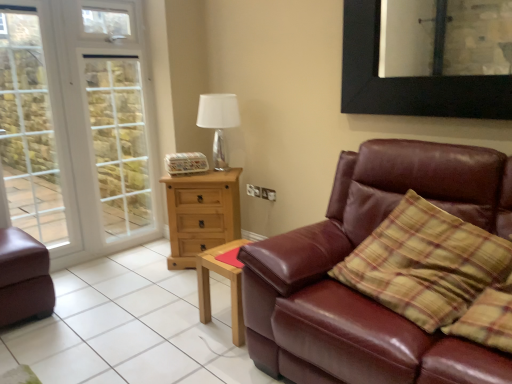
The height and width of the screenshot is (384, 512). What do you see at coordinates (230, 286) in the screenshot?
I see `light wood rectangular table at center` at bounding box center [230, 286].

The width and height of the screenshot is (512, 384). What do you see at coordinates (356, 291) in the screenshot? I see `shiny brown leather couch at right, which is counted as the 1th studio couch, starting from the right` at bounding box center [356, 291].

The height and width of the screenshot is (384, 512). Identify the location of white glass window at left. pyautogui.click(x=34, y=129).

Considering the sizes of objects white glossy table lamp at upper center and white glass screen door at left in the image provided, who is taller, white glossy table lamp at upper center or white glass screen door at left?

Standing taller between the two is white glass screen door at left.

In the image, there is a white glass screen door at left. Identify the location of table lamp below it (from a real-world perspective). (218, 122).

Is white glossy table lamp at upper center inside the boundaries of white glass screen door at left, or outside?

white glossy table lamp at upper center cannot be found inside white glass screen door at left.

How far apart are white glossy table lamp at upper center and white glass screen door at left?

white glossy table lamp at upper center and white glass screen door at left are 1.18 meters apart.

Are light wood rectangular table at center and white glass screen door at left making contact?

No, light wood rectangular table at center is not with white glass screen door at left.

Is light wood rectangular table at center in front of or behind white glass screen door at left in the image?

light wood rectangular table at center is positioned closer to the viewer than white glass screen door at left.

Is light wood rectangular table at center inside the boundaries of white glass screen door at left, or outside?

light wood rectangular table at center is spatially situated outside white glass screen door at left.

Between light wood rectangular table at center and white glass screen door at left, which one appears on the right side from the viewer's perspective?

light wood rectangular table at center.

Consider the image. Is white glass window at left surrounding shiny brown leather couch at right, which is counted as the 1th studio couch, starting from the right?

No, shiny brown leather couch at right, which is counted as the 1th studio couch, starting from the right, is not surrounded by white glass window at left.

Is white glass window at left taller than shiny brown leather couch at right, the 2th studio couch viewed from the left?

Correct, white glass window at left is much taller as shiny brown leather couch at right, the 2th studio couch viewed from the left.

Is white glass window at left facing away from shiny brown leather couch at right, the 2th studio couch viewed from the left?

white glass window at left does not have its back to shiny brown leather couch at right, the 2th studio couch viewed from the left.

In the scene shown: From the image's perspective, which one is positioned higher, white glass window at left or shiny brown leather couch at right, the 2th studio couch viewed from the left?

white glass window at left.

Would you consider white glass screen door at left to be distant from white glass window at left?

No, white glass screen door at left is not far from white glass window at left.

In the scene shown: Considering the sizes of objects white glass screen door at left and white glass window at left in the image provided, who is taller, white glass screen door at left or white glass window at left?

Standing taller between the two is white glass screen door at left.

Is white glass screen door at left behind white glass window at left?

That is True.

Which of these two, white glass screen door at left or white glass window at left, is thinner?

Result: white glass window at left is thinner.

Which object is closer to the camera, white glossy table lamp at upper center or light brown wooden chest of drawers at center?

light brown wooden chest of drawers at center is in front.

Can you confirm if white glossy table lamp at upper center is wider than light brown wooden chest of drawers at center?

In fact, white glossy table lamp at upper center might be narrower than light brown wooden chest of drawers at center.

Based on the photo, is white glossy table lamp at upper center in contact with light brown wooden chest of drawers at center?

white glossy table lamp at upper center and light brown wooden chest of drawers at center are not in contact.

Considering the positions of point (223, 115) and point (196, 252), is point (223, 115) closer or farther from the camera than point (196, 252)?

Clearly, point (223, 115) is closer to the camera than point (196, 252).

From a real-world perspective, which object rests below the other?

light wood rectangular table at center is physically lower.

Relative to light wood rectangular table at center, is white glossy table lamp at upper center in front or behind?

Visually, white glossy table lamp at upper center is located behind light wood rectangular table at center.

Considering the positions of objects white glossy table lamp at upper center and light wood rectangular table at center in the image provided, who is more to the right, white glossy table lamp at upper center or light wood rectangular table at center?

Positioned to the right is light wood rectangular table at center.

Considering the sizes of white glossy table lamp at upper center and light wood rectangular table at center in the image, is white glossy table lamp at upper center wider or thinner than light wood rectangular table at center?

Clearly, white glossy table lamp at upper center has less width compared to light wood rectangular table at center.

Based on their positions, is white glass window at left located to the left or right of white glass screen door at left?

white glass window at left is positioned on white glass screen door at left's left side.

Looking at this image, is white glass window at left positioned with its back to white glass screen door at left?

No, white glass window at left's orientation is not away from white glass screen door at left.

Is point (0, 138) positioned in front of point (88, 115)?

Yes, it is.

Can you confirm if white glass window at left is shorter than white glass screen door at left?

Yes, white glass window at left is shorter than white glass screen door at left.

Where is `screen door that appears in front of the white glossy table lamp at upper center`? screen door that appears in front of the white glossy table lamp at upper center is located at coordinates (120, 143).

The width and height of the screenshot is (512, 384). I want to click on table that is on the right side of white glass screen door at left, so click(x=230, y=286).

From the image, which object appears to be farther from brown leather couch at lower right, light wood rectangular table at center or light brown wooden chest of drawers at center?

light brown wooden chest of drawers at center.

Looking at the image, which one is located closer to matte brown leather couch at lower left, the second studio couch from the right, white glass screen door at left or white glass window at left?

white glass window at left is closer to matte brown leather couch at lower left, the second studio couch from the right.

Considering their positions, is white glass screen door at left positioned further to white glass window at left than shiny brown leather couch at right, the 2th studio couch viewed from the left?

The object further to white glass window at left is shiny brown leather couch at right, the 2th studio couch viewed from the left.

From the image, which object appears to be farther from shiny brown leather couch at right, the 2th studio couch viewed from the left, white glass window at left or light wood rectangular table at center?

Based on the image, white glass window at left appears to be further to shiny brown leather couch at right, the 2th studio couch viewed from the left.

Consider the image. Considering their positions, is light wood rectangular table at center positioned further to white glossy table lamp at upper center than light brown wooden chest of drawers at center?

light wood rectangular table at center is positioned further to the anchor white glossy table lamp at upper center.

When comparing their distances from light brown wooden chest of drawers at center, does matte brown leather couch at lower left, the second studio couch from the right, or white glossy table lamp at upper center seem further?

Among the two, matte brown leather couch at lower left, the second studio couch from the right, is located further to light brown wooden chest of drawers at center.

When comparing their distances from light brown wooden chest of drawers at center, does white glossy table lamp at upper center or white glass screen door at left seem closer?

Among the two, white glossy table lamp at upper center is located nearer to light brown wooden chest of drawers at center.

Looking at this image, estimate the real-world distances between objects in this image. Which object is further from matte brown leather couch at lower left, the second studio couch from the right, white glass window at left or light brown wooden chest of drawers at center?

light brown wooden chest of drawers at center is positioned further to the anchor matte brown leather couch at lower left, the second studio couch from the right.

The image size is (512, 384). Identify the location of tile situated between matte brown leather couch at lower left, the second studio couch from the right, and light wood rectangular table at center from left to right. (131, 327).

Find the location of a particular element. The height and width of the screenshot is (384, 512). table positioned between brown leather couch at lower right and light brown wooden chest of drawers at center from near to far is located at coordinates (230, 286).

Locate an element on the screen. Image resolution: width=512 pixels, height=384 pixels. screen door between white glass window at left and shiny brown leather couch at right, the 2th studio couch viewed from the left, in the horizontal direction is located at coordinates (120, 143).

The height and width of the screenshot is (384, 512). I want to click on chest of drawers between white glossy table lamp at upper center and light wood rectangular table at center in the vertical direction, so click(201, 214).